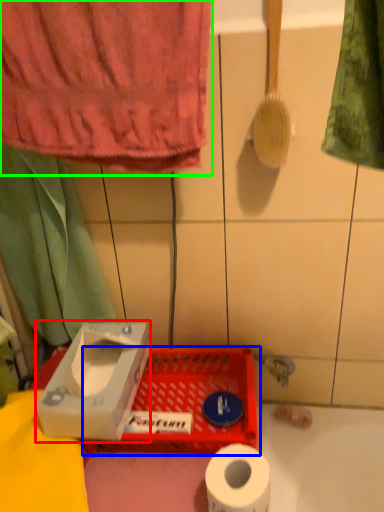
Question: Estimate the real-world distances between objects in this image. Which object is closer to cardboard box (highlighted by a red box), basket (highlighted by a blue box) or towel (highlighted by a green box)?

Choices:
 (A) basket
 (B) towel

Answer: (A)